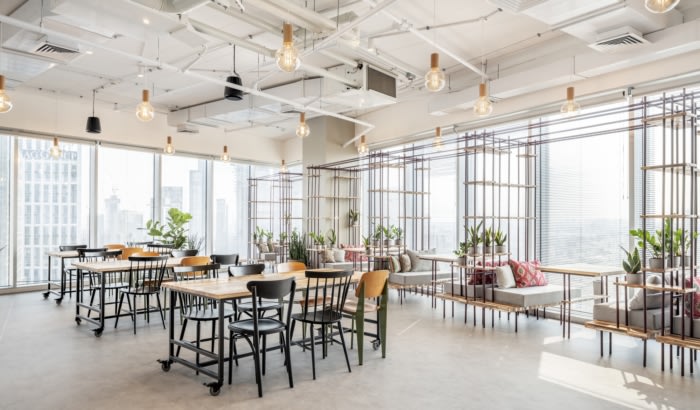
Where is `table rolling casters`? table rolling casters is located at coordinates (215, 391), (166, 367), (94, 331), (77, 320), (57, 302), (42, 294), (374, 343), (316, 330).